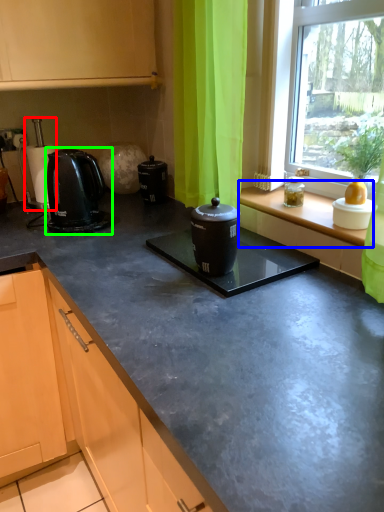
Question: Considering the real-world distances, which object is closest to coffee machine (highlighted by a red box)? window sill (highlighted by a blue box) or home appliance (highlighted by a green box).

Choices:
 (A) window sill
 (B) home appliance

Answer: (B)